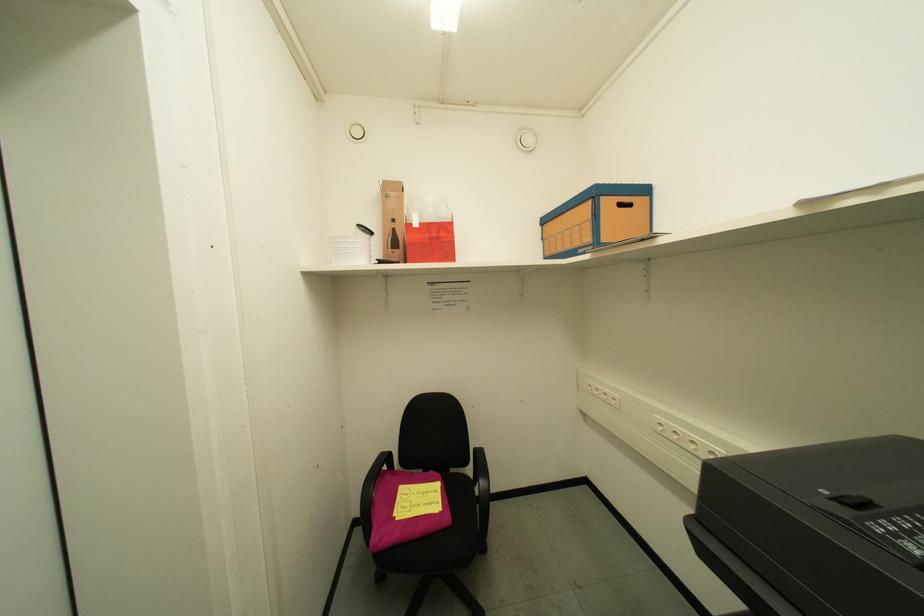
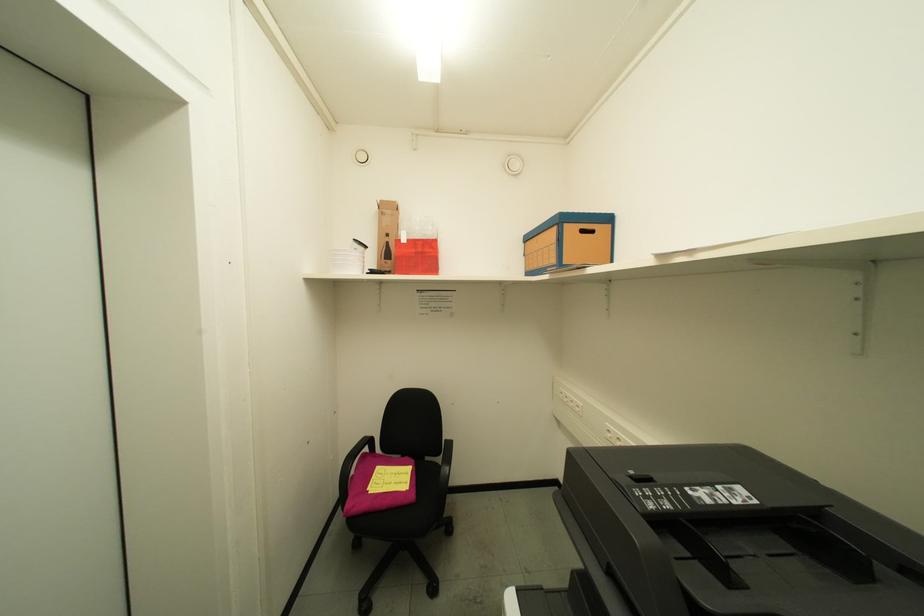
Which direction would the cameraman need to move to produce the second image?

The cameraman walked toward right, backward.